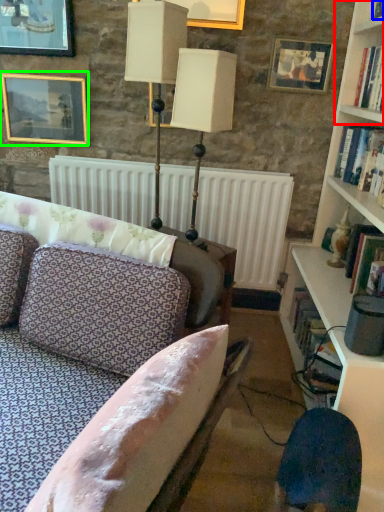
Question: Which is nearer to the shelf (highlighted by a red box)? book (highlighted by a blue box) or picture frame (highlighted by a green box).

Choices:
 (A) book
 (B) picture frame

Answer: (A)